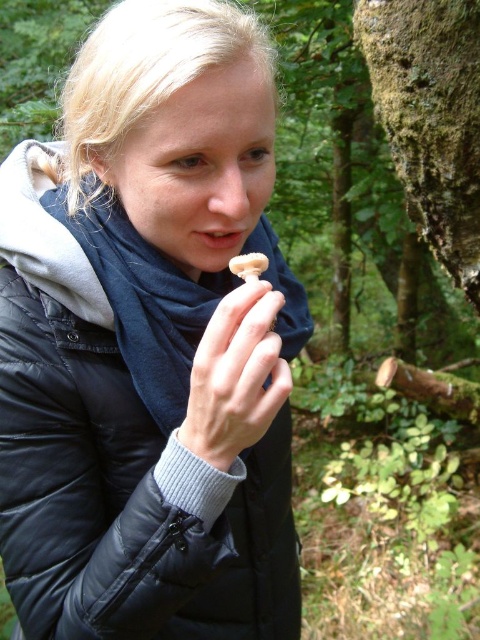
You are a nature photographer trying to capture the interaction between the smooth skin hand at center and the white matte mushroom at center. Based on their positions, which object should you focus on first to ensure both are in frame?

The smooth skin hand at center is below the white matte mushroom at center, so you should focus on the white matte mushroom at center first to ensure both are in frame.

You are a hiker who wants to take a photo of the white matte mushroom at center while wearing the black quilted jacket at center. Can you stand in a way that the mushroom appears above your jacket in the picture?

The black quilted jacket at center is positioned under the white matte mushroom at center, so yes, you can stand so the mushroom appears above your jacket in the photo.